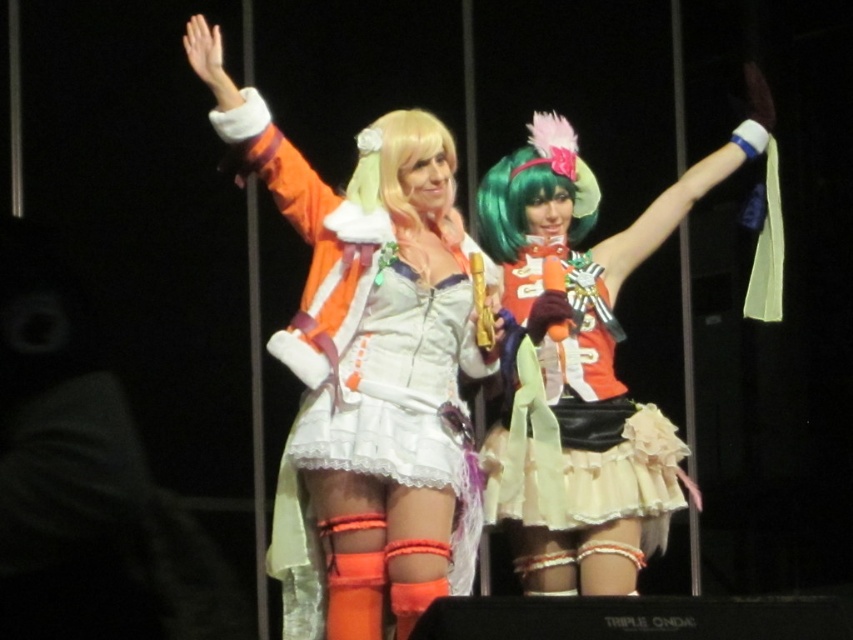
Is point (287, 592) positioned after point (531, 348)?

No, it is in front of (531, 348).

Measure the distance between matte orange jacket at center and orange satin skirt at center.

matte orange jacket at center is 35.59 inches away from orange satin skirt at center.

Who is more forward, (431, 118) or (544, 488)?

Point (544, 488) is more forward.

Locate an element on the screen. matte orange jacket at center is located at coordinates (366, 369).

Is orange satin skirt at center positioned behind blonde wig at center?

Yes, it is behind blonde wig at center.

Who is more forward, (x=521, y=449) or (x=419, y=124)?

Point (x=419, y=124) is in front.

Where is `orange satin skirt at center`? The width and height of the screenshot is (853, 640). orange satin skirt at center is located at coordinates (577, 417).

Which is in front, point (312, 572) or point (519, 317)?

Point (312, 572) is in front.

Is point (428, 152) positioned in front of point (604, 528)?

Yes, it is.

Identify the location of matte orange jacket at center. This screenshot has height=640, width=853. (366, 369).